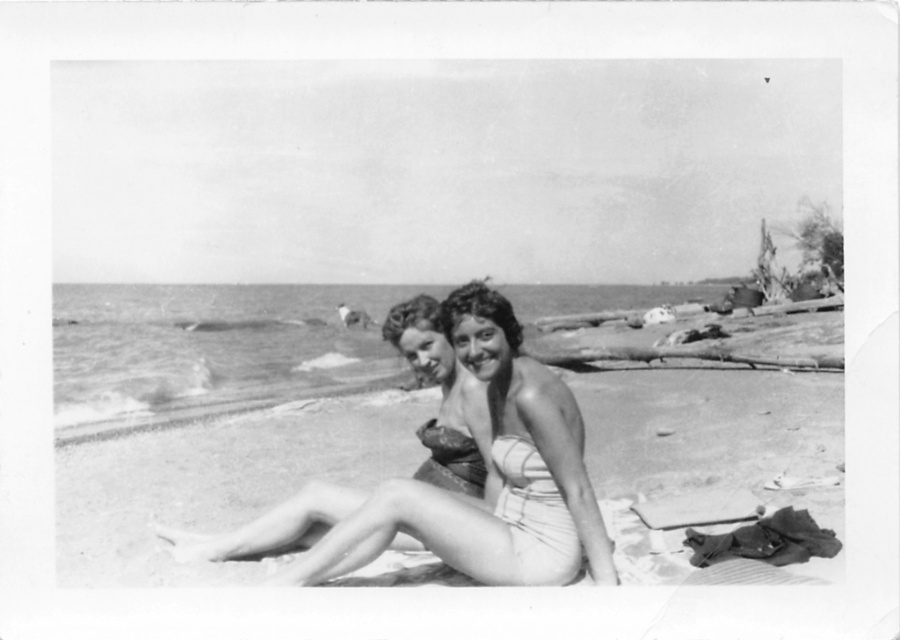
Question: Which of these objects is positioned farthest from the smooth fabric bikini at center?

Choices:
 (A) smooth skin bikini at center
 (B) matte swimsuit at center
 (C) matte fabric bikini top at center

Answer: (C)

Question: Estimate the real-world distances between objects in this image. Which object is closer to the smooth skin bikini at center?

Choices:
 (A) smooth fabric bikini at center
 (B) matte swimsuit at center
 (C) matte fabric bikini top at center

Answer: (B)

Question: Can you confirm if smooth fabric bikini at center is smaller than matte swimsuit at center?

Choices:
 (A) yes
 (B) no

Answer: (B)

Question: Estimate the real-world distances between objects in this image. Which object is farther from the smooth skin bikini at center?

Choices:
 (A) matte fabric bikini top at center
 (B) smooth fabric bikini at center

Answer: (B)

Question: Can you confirm if smooth skin bikini at center is positioned to the left of matte fabric bikini top at center?

Choices:
 (A) no
 (B) yes

Answer: (A)

Question: Does smooth skin bikini at center appear on the left side of matte swimsuit at center?

Choices:
 (A) no
 (B) yes

Answer: (A)